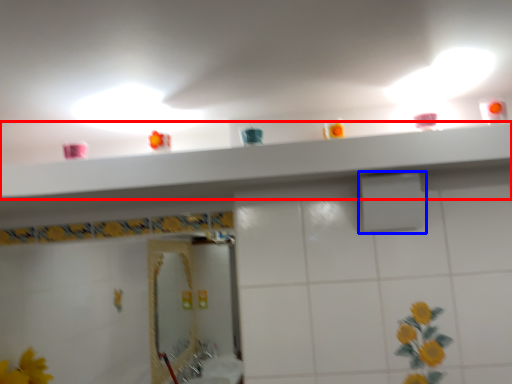
Question: Which object appears closest to the camera in this image, shelve (highlighted by a red box) or shower (highlighted by a blue box)?

Choices:
 (A) shelve
 (B) shower

Answer: (A)